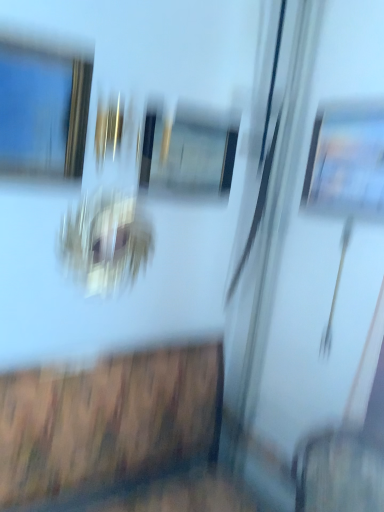
Question: From a real-world perspective, is metallic gold frame at upper left beneath transparent glass screen door at center?

Choices:
 (A) no
 (B) yes

Answer: (A)

Question: From a real-world perspective, is metallic gold frame at upper left on top of transparent glass screen door at center?

Choices:
 (A) no
 (B) yes

Answer: (B)

Question: Can you confirm if metallic gold frame at upper left is shorter than transparent glass screen door at center?

Choices:
 (A) no
 (B) yes

Answer: (B)

Question: Is metallic gold frame at upper left to the right of transparent glass screen door at center from the viewer's perspective?

Choices:
 (A) yes
 (B) no

Answer: (B)

Question: Is metallic gold frame at upper left outside transparent glass screen door at center?

Choices:
 (A) no
 (B) yes

Answer: (B)

Question: Is metallic gold frame at upper left far away from transparent glass screen door at center?

Choices:
 (A) yes
 (B) no

Answer: (B)

Question: Is transparent glass screen door at center taller than metallic gold frame at upper left?

Choices:
 (A) yes
 (B) no

Answer: (A)

Question: Can you confirm if transparent glass screen door at center is shorter than metallic gold frame at upper left?

Choices:
 (A) yes
 (B) no

Answer: (B)

Question: From the image's perspective, does transparent glass screen door at center appear lower than metallic gold frame at upper left?

Choices:
 (A) yes
 (B) no

Answer: (A)

Question: Can you confirm if transparent glass screen door at center is smaller than metallic gold frame at upper left?

Choices:
 (A) no
 (B) yes

Answer: (A)

Question: Is transparent glass screen door at center directly adjacent to metallic gold frame at upper left?

Choices:
 (A) no
 (B) yes

Answer: (A)

Question: Considering the relative sizes of transparent glass screen door at center and metallic gold frame at upper left in the image provided, is transparent glass screen door at center wider than metallic gold frame at upper left?

Choices:
 (A) yes
 (B) no

Answer: (B)

Question: From a real-world perspective, is metallic gold frame at upper left physically located above or below transparent glass screen door at center?

Choices:
 (A) below
 (B) above

Answer: (B)